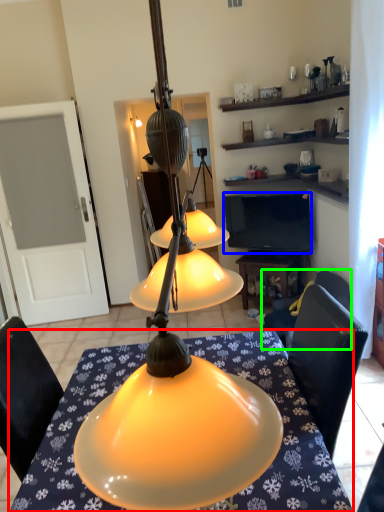
Question: Which is farther away from desk (highlighted by a red box)? television (highlighted by a blue box) or chair (highlighted by a green box)?

Choices:
 (A) television
 (B) chair

Answer: (A)